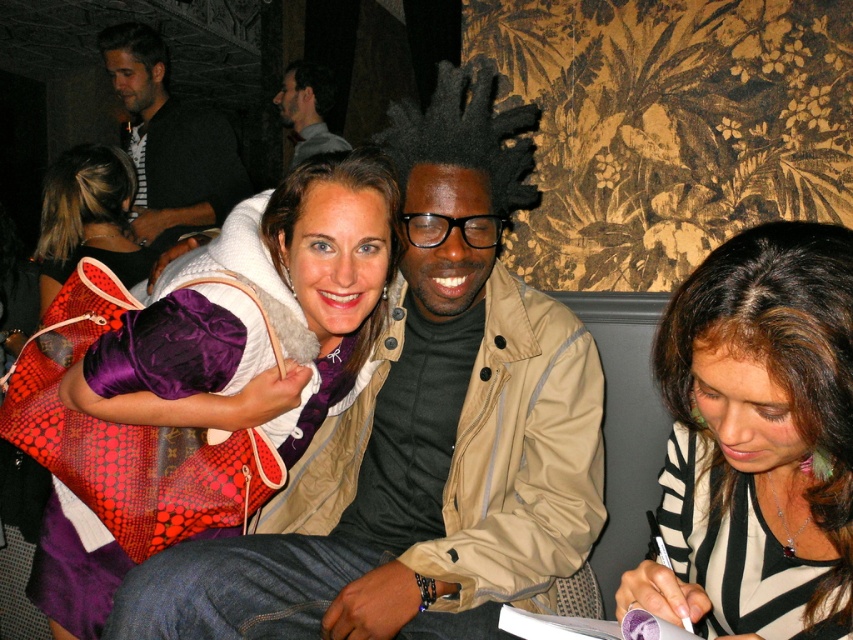
In the image, there are three people sitting on a dark couch. The person on the left is wearing a white jacket with a fur lining and a purple top. The person in the center has a point at coordinates (421, 433). What is the person at the center wearing?

The person at the center is wearing a matte beige jacket as indicated by the point at coordinates (421, 433).

You are standing in the room and want to move from point A to point B. Point A is at coordinate point (180, 636) and point B is at coordinate point (792, 532). Which point is closer to you when you are facing the image?

Point A at coordinate point (180, 636) is closer to you than point B at coordinate point (792, 532) because it is further to the viewer according to the description.